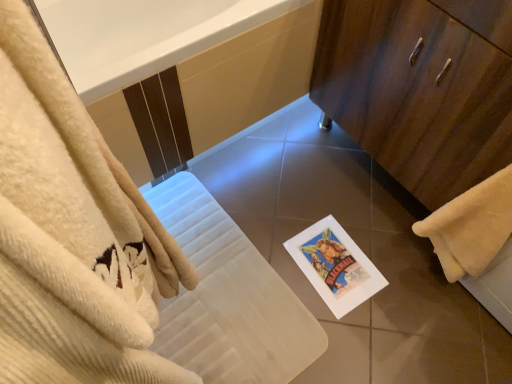
This screenshot has height=384, width=512. What are the coordinates of `vacant area that is in front of white paper postcard at center` in the screenshot? It's located at (353, 333).